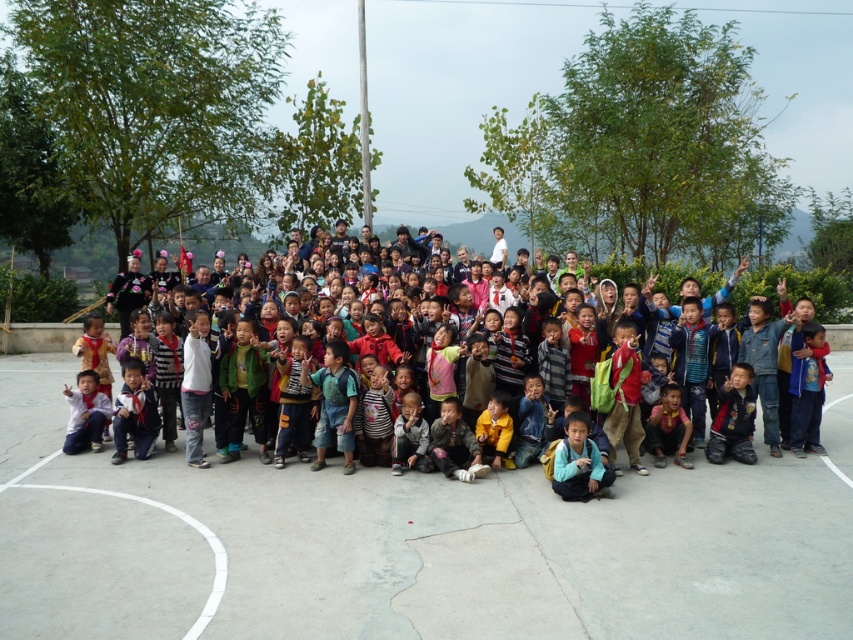
You are a photographer trying to capture a photo of the gray concrete basketball court at center and the multicolored clothing at center. Which object should you focus on first if you want to ensure both are in focus without adjusting the camera settings?

The gray concrete basketball court at center is shorter in height compared to the multicolored clothing at center. Since the basketball court is closer to the camera, you should focus on the gray concrete basketball court at center first to ensure both are in focus.

You are standing at the entrance of the sports court and want to walk directly to the gray concrete basketball court at center. According to the coordinates provided, in which direction should you move relative to your current position?

The gray concrete basketball court at center is located at point 0.848 on the x and 0.485 on the y coordinates. Since you are at the entrance, which is likely at a lower x or y coordinate, you should move towards increasing x and y directions to reach the court.